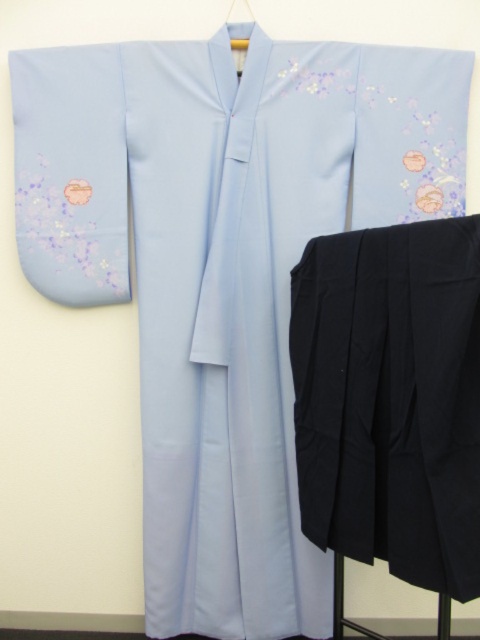
Question: Which point is farther to the camera?

Choices:
 (A) (248, 17)
 (B) (294, 362)

Answer: (A)

Question: Can you confirm if black matte pants at lower right is positioned above matte plastic hanger at upper center?

Choices:
 (A) no
 (B) yes

Answer: (A)

Question: Can you confirm if black matte pants at lower right is positioned to the left of matte plastic hanger at upper center?

Choices:
 (A) yes
 (B) no

Answer: (B)

Question: Is black matte pants at lower right above matte plastic hanger at upper center?

Choices:
 (A) yes
 (B) no

Answer: (B)

Question: Which point is closer to the camera taking this photo?

Choices:
 (A) (439, 396)
 (B) (248, 8)

Answer: (A)